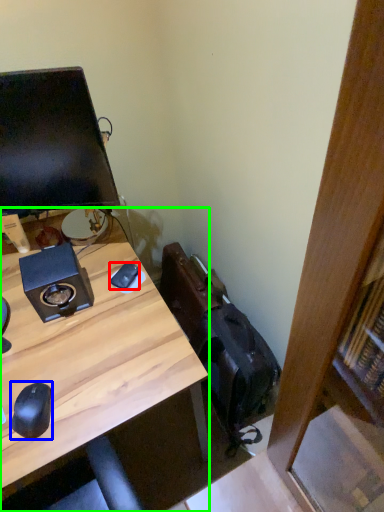
Question: Which object is the farthest from mouse (highlighted by a red box)? Choose among these: mouse (highlighted by a blue box) or desk (highlighted by a green box).

Choices:
 (A) mouse
 (B) desk

Answer: (A)